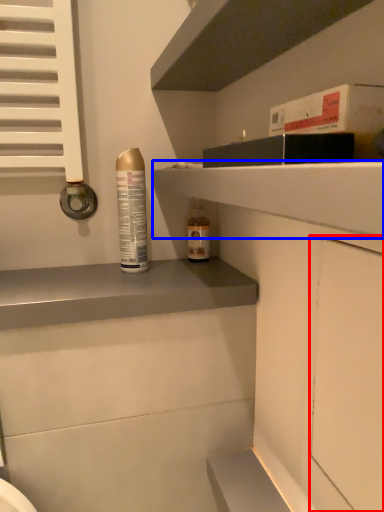
Question: Which object is further to the camera taking this photo, screen door (highlighted by a red box) or shelf (highlighted by a blue box)?

Choices:
 (A) screen door
 (B) shelf

Answer: (B)